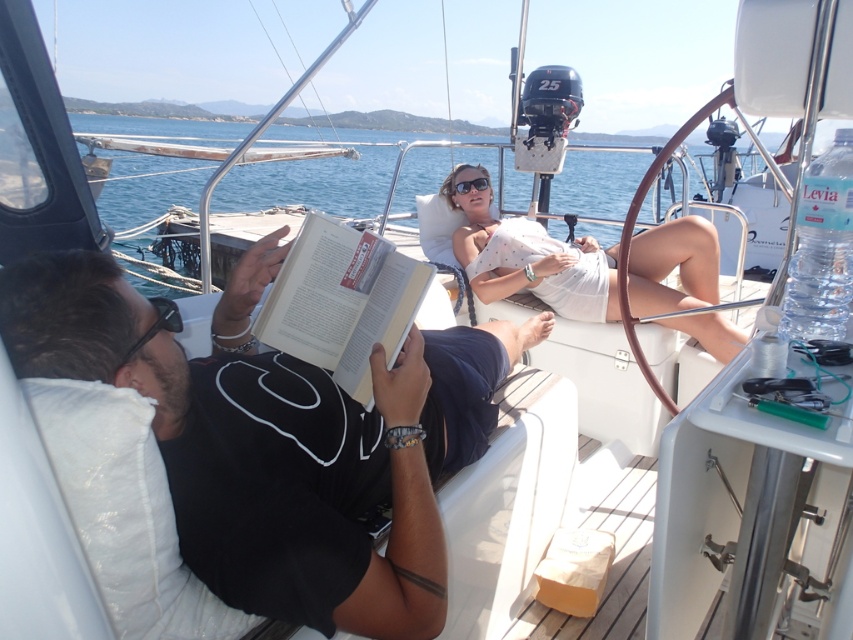
Which is above, black matte book at center or clear blue water at center?

clear blue water at center is higher up.

Who is taller, black matte book at center or clear blue water at center?

clear blue water at center is taller.

Where is `black matte book at center`? black matte book at center is located at coordinates (279, 436).

Is black matte book at center smaller than hardcover book at center?

Incorrect, black matte book at center is not smaller in size than hardcover book at center.

The width and height of the screenshot is (853, 640). Identify the location of black matte book at center. (279, 436).

Is the position of white cotton dress at center more distant than that of hardcover book at center?

Yes, it is behind hardcover book at center.

Which is in front, point (717, 348) or point (300, 317)?

Point (300, 317) is in front.

Where is `white cotton dress at center`? white cotton dress at center is located at coordinates (531, 259).

What are the coordinates of `white cotton dress at center` in the screenshot? It's located at (531, 259).